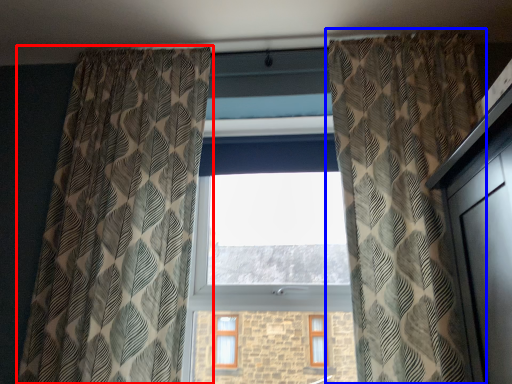
Question: Which object appears closest to the camera in this image, curtain (highlighted by a red box) or curtain (highlighted by a blue box)?

Choices:
 (A) curtain
 (B) curtain

Answer: (B)